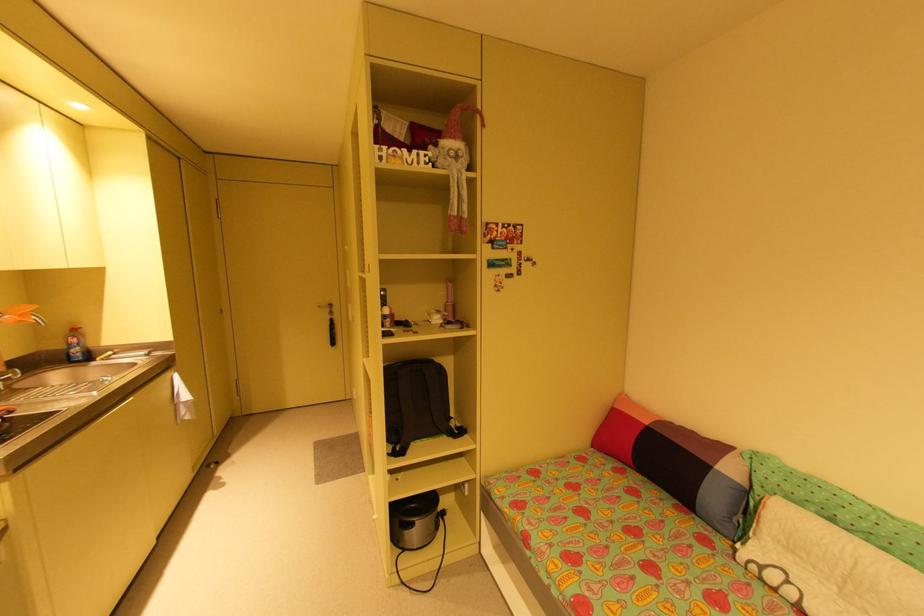
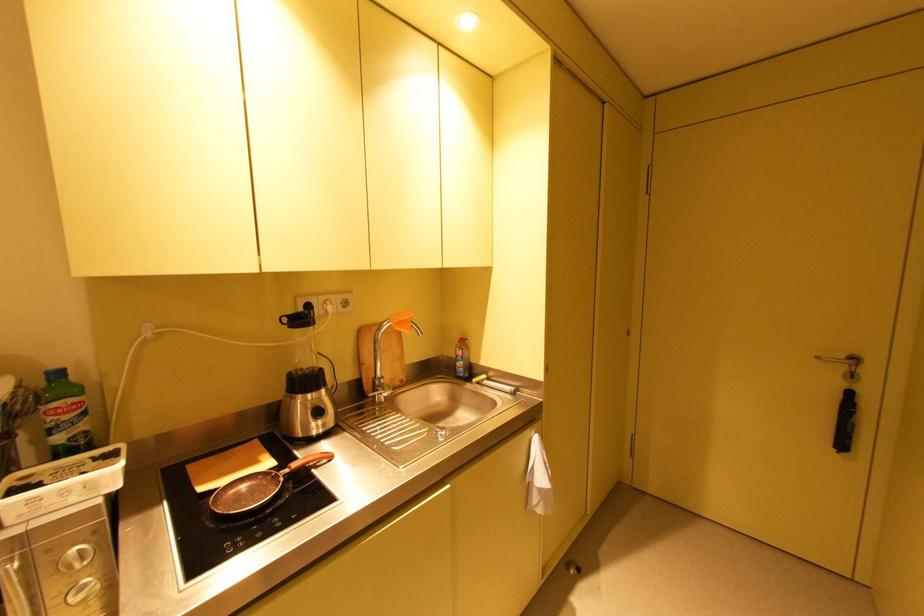
Where in the second image is the point corresponding to (25,315) from the first image?

(400, 325)